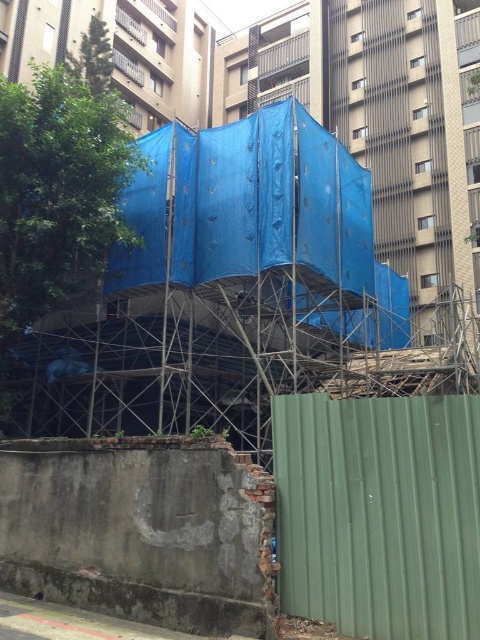
You are a delivery person trying to access the construction site. You notice the green corrugated metal fence at lower right and the metallic scaffolding at center. Which object would block your path more if you approach from the right side?

The green corrugated metal fence at lower right is larger in size than the metallic scaffolding at center, so it would block your path more if you approach from the right side.

You are a delivery person trying to access the construction site. You see the green corrugated metal fence at lower right and the metallic scaffolding at center. Which object is closer to the ground?

The green corrugated metal fence at lower right is below metallic scaffolding at center, so it is closer to the ground.

You are standing at the center of the construction site and see the point marked at coordinates point (380, 513). What object is located at that point?

The point (380, 513) corresponds to the green corrugated metal fence at lower right.